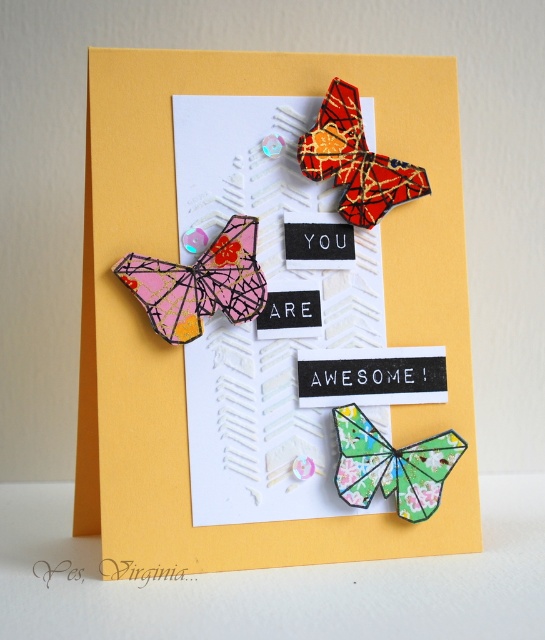
Can you confirm if metallic gold butterfly at upper center is smaller than green textured paper butterfly at center?

Incorrect, metallic gold butterfly at upper center is not smaller in size than green textured paper butterfly at center.

The height and width of the screenshot is (640, 545). Find the location of `metallic gold butterfly at upper center`. metallic gold butterfly at upper center is located at coordinates (355, 161).

Between matte pink paper butterfly at left and green textured paper butterfly at center, which one has more height?

With more height is matte pink paper butterfly at left.

Is matte pink paper butterfly at left in front of green textured paper butterfly at center?

Yes, it is.

Is point (137, 282) closer to viewer compared to point (407, 483)?

Yes, it is in front of point (407, 483).

Where is `matte pink paper butterfly at left`? The image size is (545, 640). matte pink paper butterfly at left is located at coordinates (199, 284).

Can you confirm if yellow paper card at upper center is taller than green textured paper butterfly at center?

Yes.

The image size is (545, 640). What are the coordinates of `yellow paper card at upper center` in the screenshot? It's located at (181, 349).

The image size is (545, 640). In order to click on yellow paper card at upper center in this screenshot , I will do `click(181, 349)`.